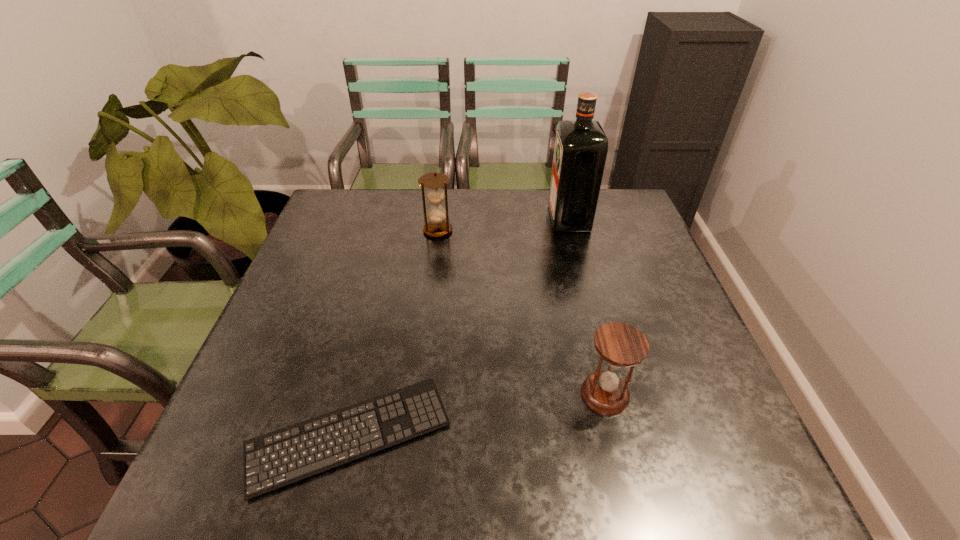
Identify the location of liquor that is at the far edge. Image resolution: width=960 pixels, height=540 pixels. (581, 146).

At what (x,y) coordinates should I click in order to perform the action: click on hourglass that is at the far edge. Please return your answer as a coordinate pair (x, y). The height and width of the screenshot is (540, 960). Looking at the image, I should click on (437, 227).

The width and height of the screenshot is (960, 540). What are the coordinates of `object situated at the near edge` in the screenshot? It's located at (273, 460).

Image resolution: width=960 pixels, height=540 pixels. Identify the location of object that is positioned at the left edge. (273, 460).

I want to click on object situated at the near left corner, so click(273, 460).

In the image, there is a desktop. Identify the location of vacant space at the far edge. (503, 214).

In the image, there is a desktop. At what (x,y) coordinates should I click in order to perform the action: click on free space at the near edge. Please return your answer as a coordinate pair (x, y). Looking at the image, I should click on (332, 490).

The image size is (960, 540). In the image, there is a desktop. In order to click on vacant area at the left edge in this screenshot , I will do `click(296, 264)`.

Where is `free space at the right edge of the desktop`? Image resolution: width=960 pixels, height=540 pixels. free space at the right edge of the desktop is located at coordinates (629, 306).

I want to click on blank space at the far left corner of the desktop, so click(361, 193).